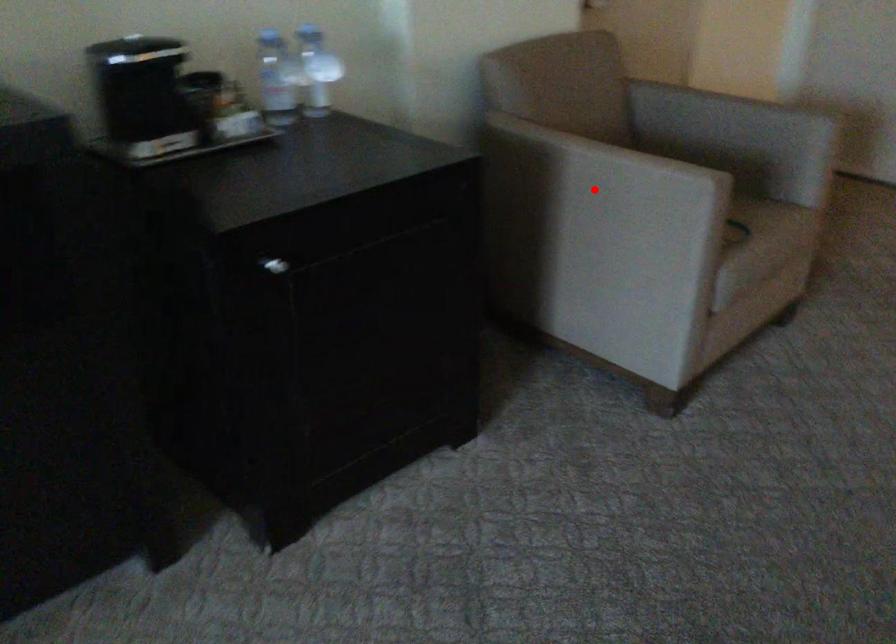
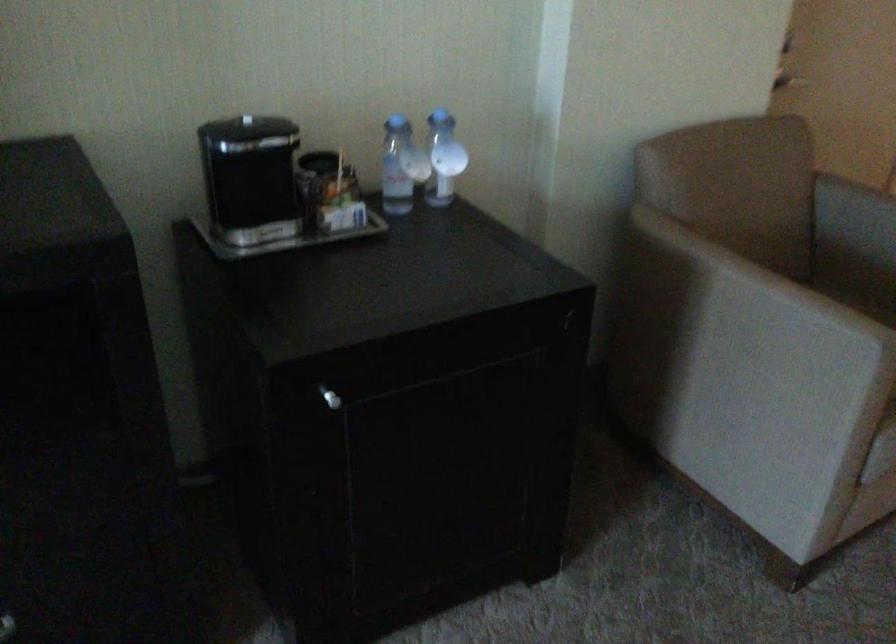
Find the pixel in the second image that matches the highlighted location in the first image.

(739, 319)